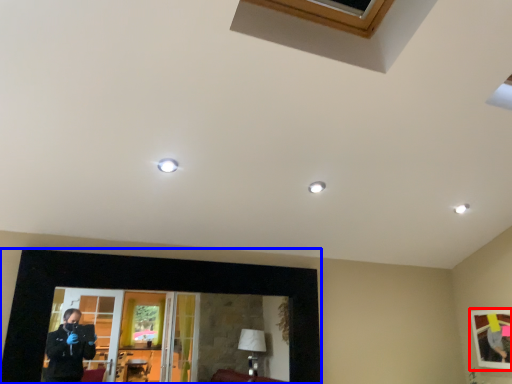
Question: Among these objects, which one is nearest to the camera, picture frame (highlighted by a red box) or picture frame (highlighted by a blue box)?

Choices:
 (A) picture frame
 (B) picture frame

Answer: (B)